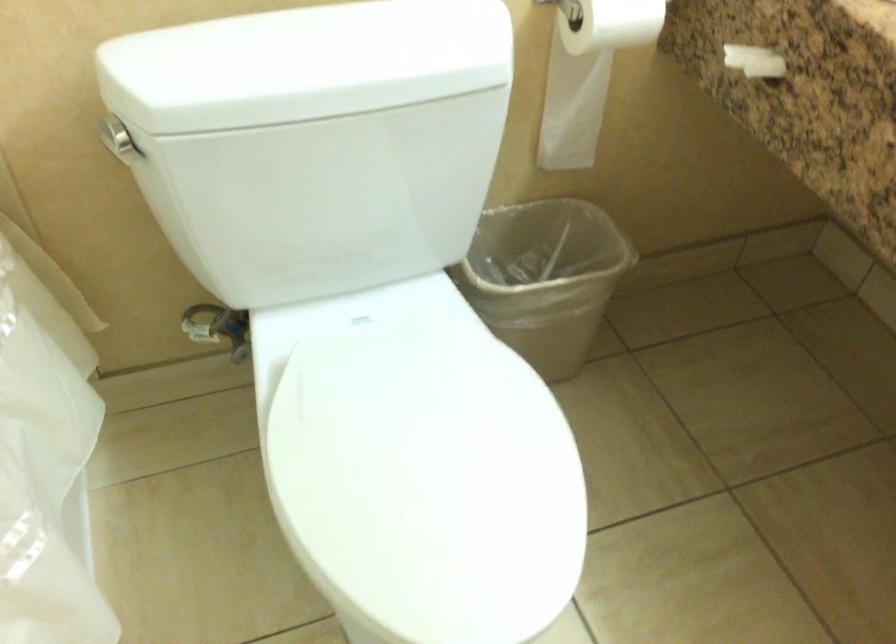
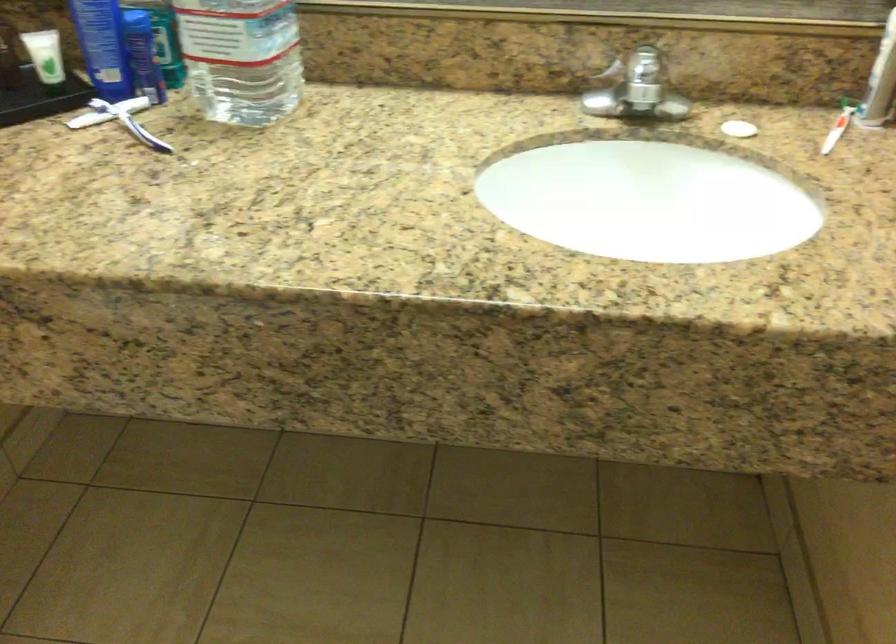
Question: The images are taken continuously from a first-person perspective. In which direction is your viewpoint rotating?

Choices:
 (A) Left
 (B) Right
 (C) Up
 (D) Down

Answer: (B)